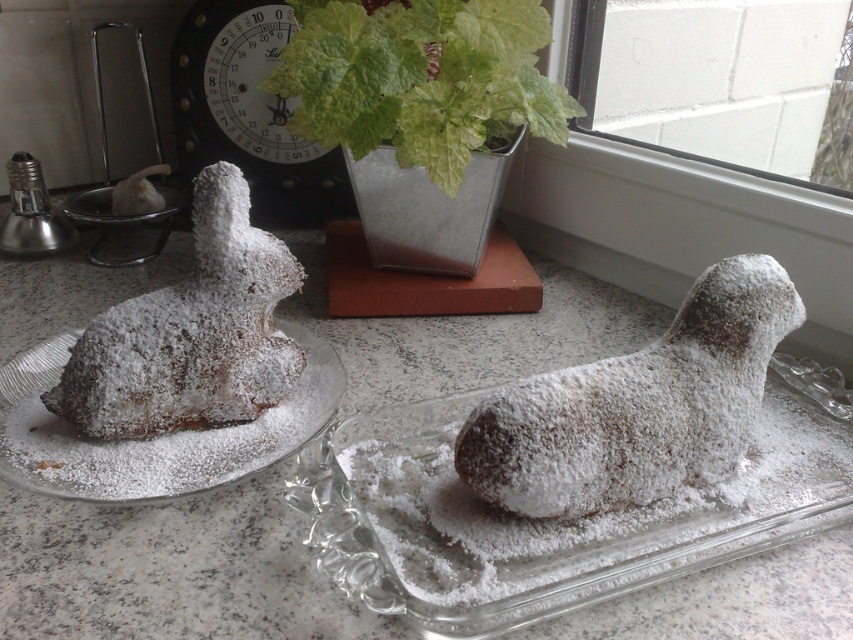
You are a baker who needs to determine which pastry is easier to handle without breaking. Based on their shapes, which one would you choose between the powdered sugar bunny at left and the powdered sugar pastry at left?

The powdered sugar bunny at left is thinner than the powdered sugar pastry at left, so the bunny might be more fragile and easier to break. Therefore, the powdered sugar pastry at left is easier to handle without breaking.

You are a photographer trying to capture a closeup of the pastry on the rectangular plate. You notice two points marked in the image at coordinates point (148,419) and point (109,449). Which point should you focus on to ensure the pastry is in focus?

You should focus on point (148,419) because it is closer to the camera than point (109,449), ensuring the pastry on the rectangular plate is in focus.